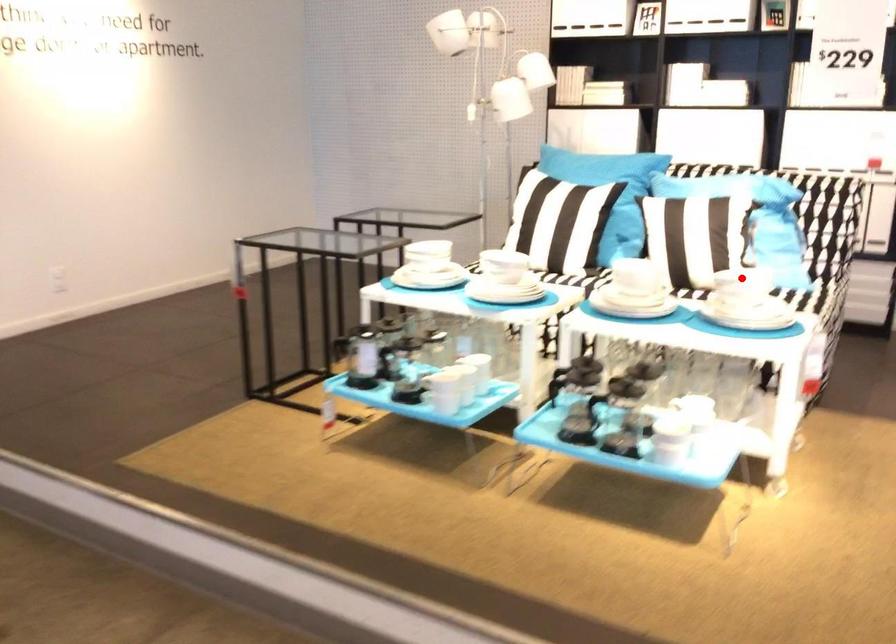
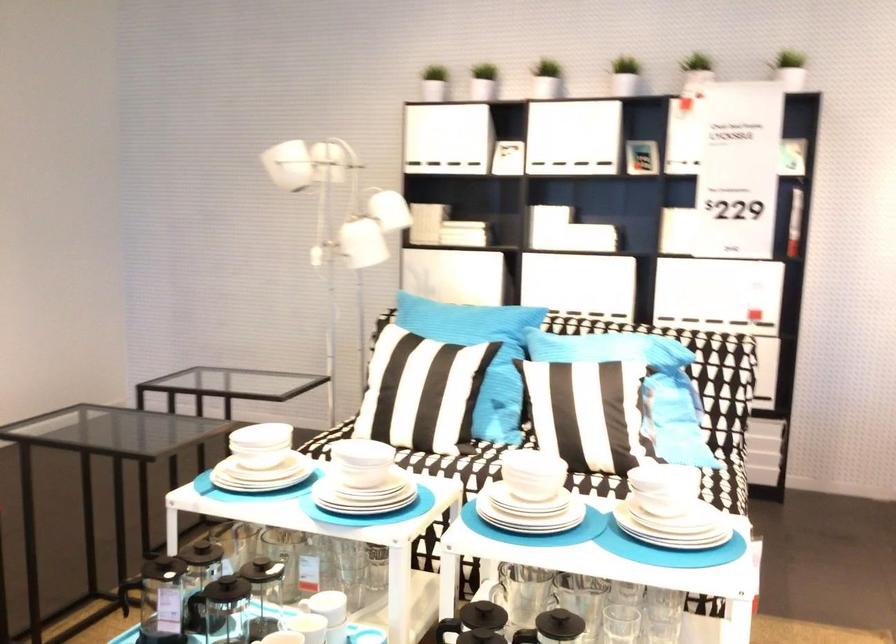
Find the pixel in the second image that matches the highlighted location in the first image.

(661, 489)